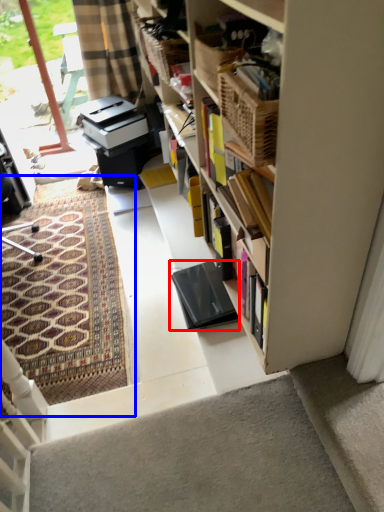
Question: Which of the following is the farthest to the observer, equipment (highlighted by a red box) or doormat (highlighted by a blue box)?

Choices:
 (A) equipment
 (B) doormat

Answer: (B)